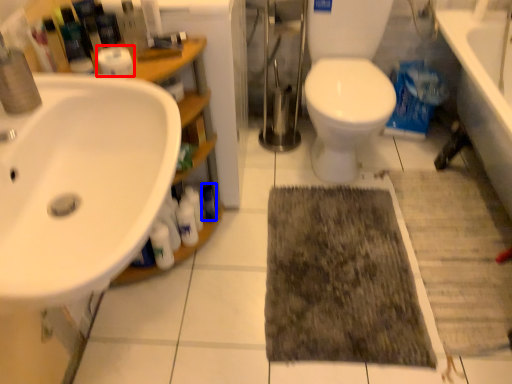
Question: Which of the following is the farthest to the observer, toilet paper (highlighted by a red box) or toiletry (highlighted by a blue box)?

Choices:
 (A) toilet paper
 (B) toiletry

Answer: (B)